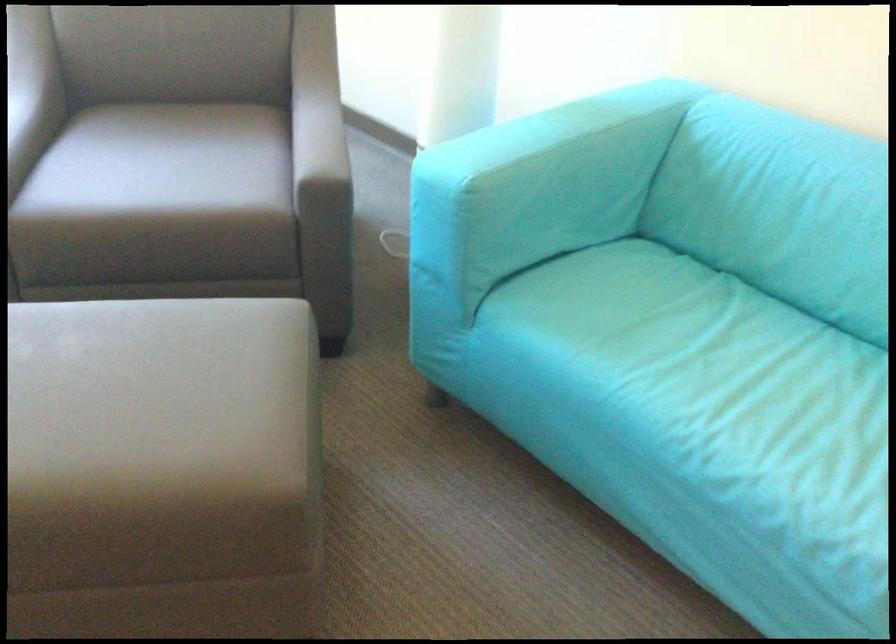
I want to click on gray chair sitting surface, so pyautogui.click(x=170, y=158).